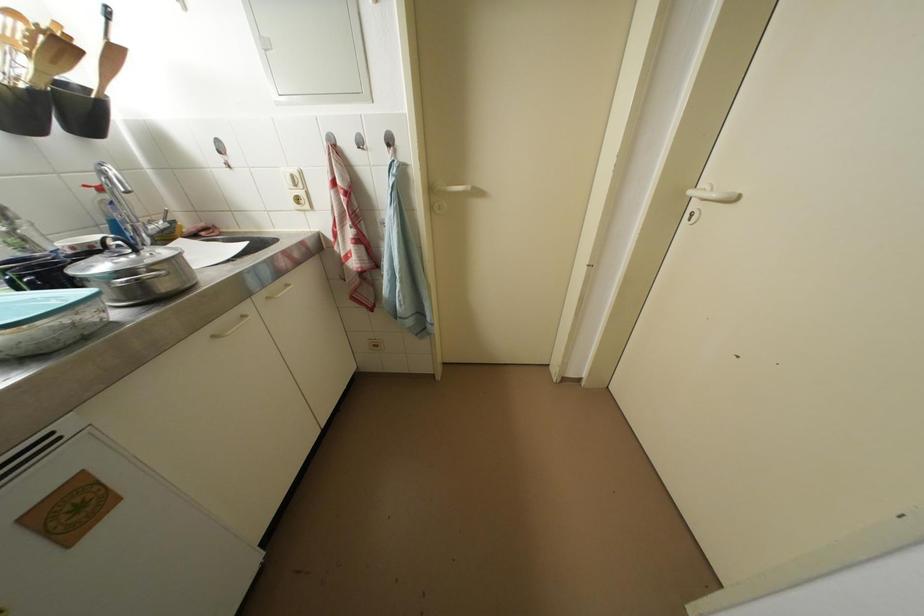
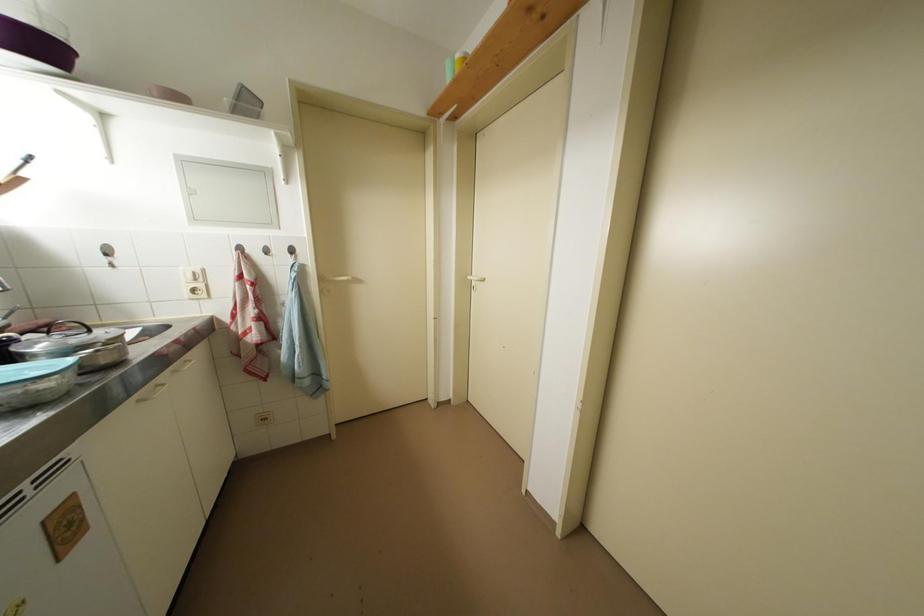
The point at (698, 197) is marked in the first image. Where is the corresponding point in the second image?

(476, 282)